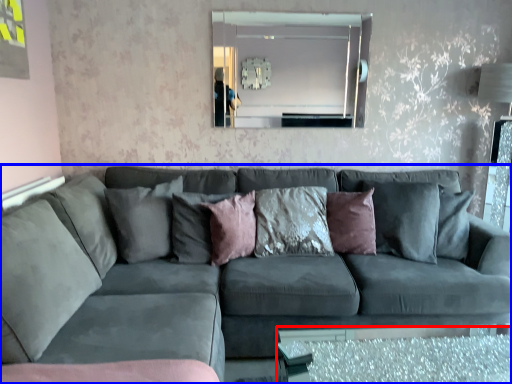
Question: Which object appears closest to the camera in this image, glass table (highlighted by a red box) or studio couch (highlighted by a blue box)?

Choices:
 (A) glass table
 (B) studio couch

Answer: (B)